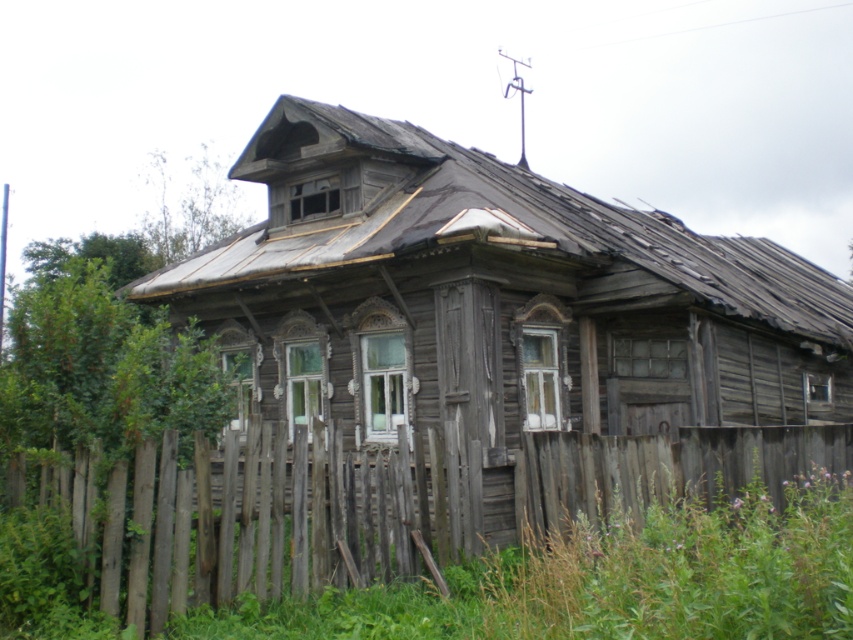
Can you confirm if weathered wood hut at center is positioned to the left of weathered wood fence at lower center?

In fact, weathered wood hut at center is to the right of weathered wood fence at lower center.

The width and height of the screenshot is (853, 640). What are the coordinates of `weathered wood hut at center` in the screenshot? It's located at (497, 298).